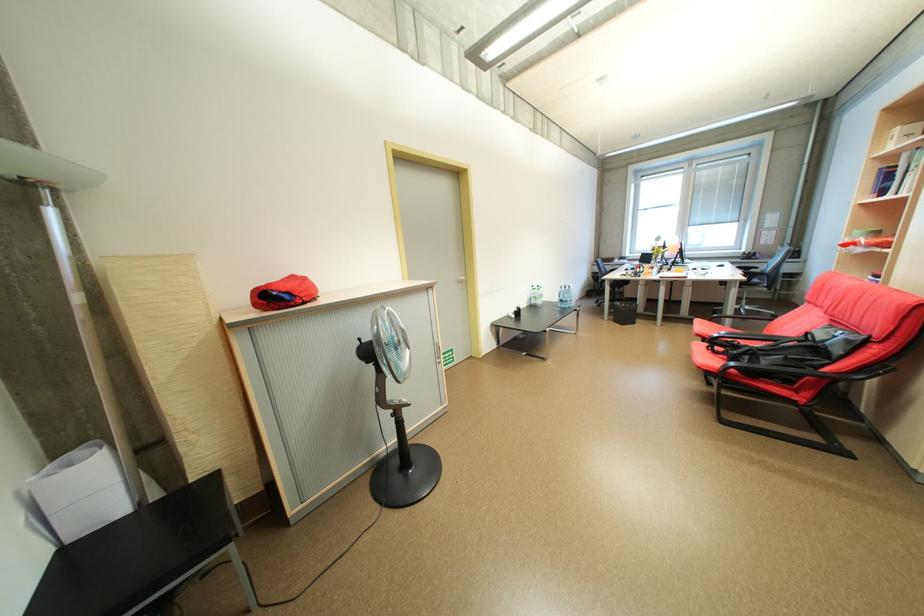
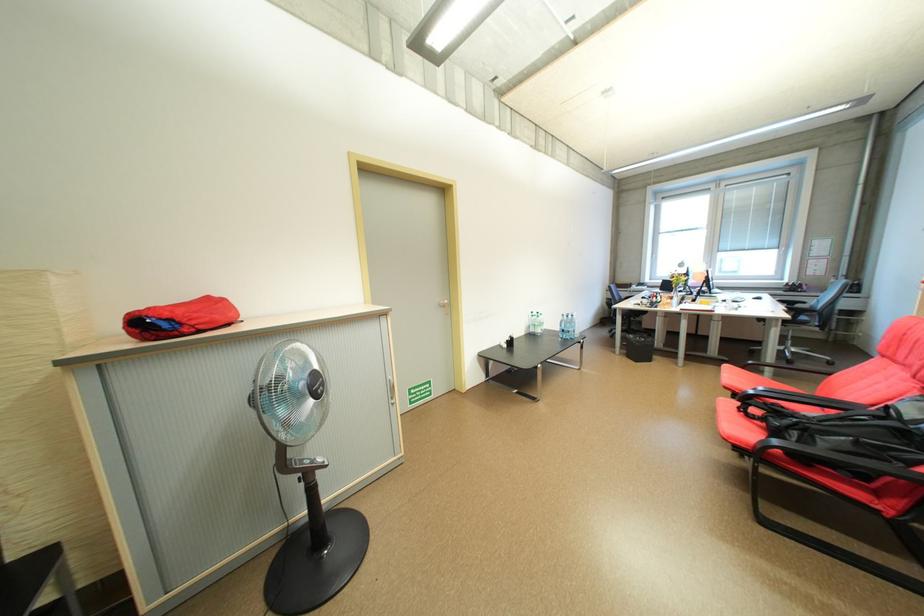
Question: Based on the continuous images, in which direction is the camera rotating? Reply with the corresponding letter.

Choices:
 (A) Left
 (B) Right
 (C) Up
 (D) Down

Answer: (A)